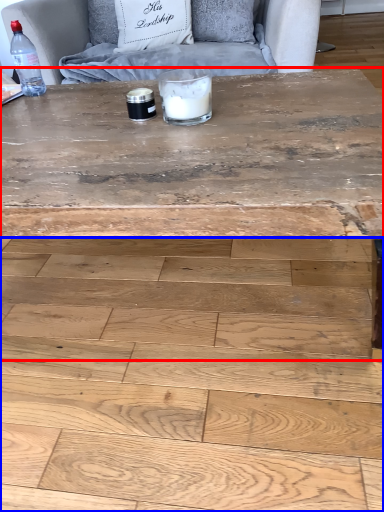
Question: Which object appears farthest to the camera in this image, coffee table (highlighted by a red box) or plywood (highlighted by a blue box)?

Choices:
 (A) coffee table
 (B) plywood

Answer: (A)